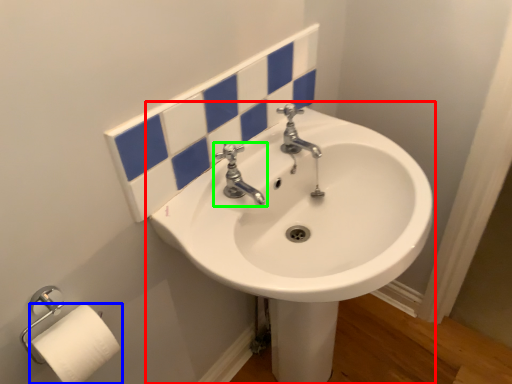
Question: Which is farther away from sink (highlighted by a red box)? toilet paper (highlighted by a blue box) or tap (highlighted by a green box)?

Choices:
 (A) toilet paper
 (B) tap

Answer: (A)